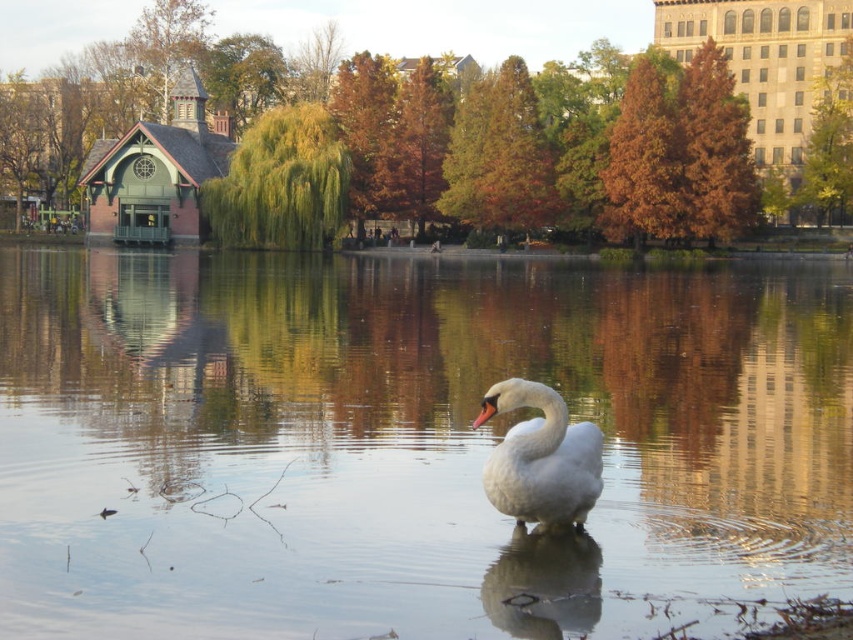
Question: Which object is closer to the camera taking this photo?

Choices:
 (A) clear water at center
 (B) white glossy swan at center

Answer: (A)

Question: Among these objects, which one is nearest to the camera?

Choices:
 (A) clear water at center
 (B) white glossy swan at center

Answer: (A)

Question: Is clear water at center below white glossy swan at center?

Choices:
 (A) yes
 (B) no

Answer: (B)

Question: Is clear water at center positioned before white glossy swan at center?

Choices:
 (A) yes
 (B) no

Answer: (A)

Question: Is the position of clear water at center less distant than that of white glossy swan at center?

Choices:
 (A) yes
 (B) no

Answer: (A)